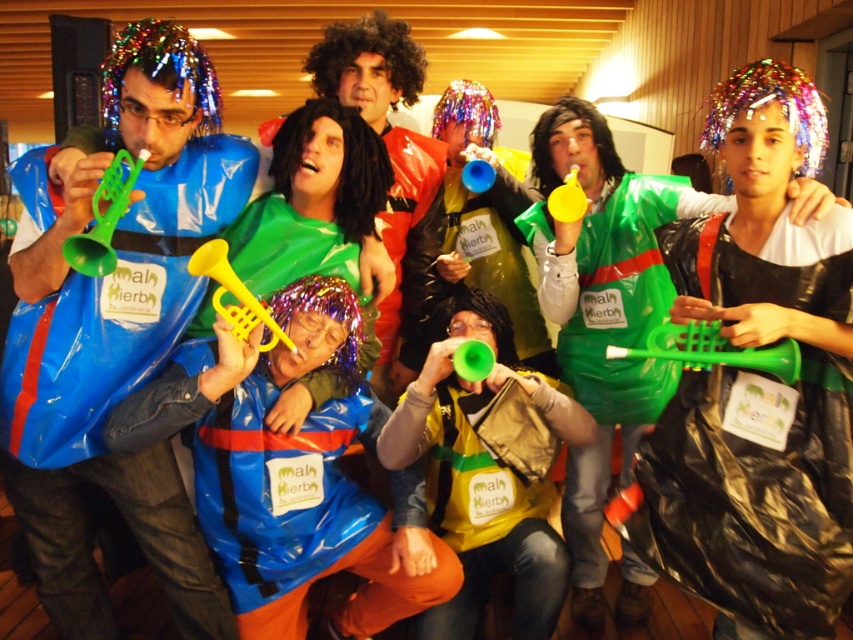
Is green plastic bag at center taller than green plastic trumpet at left?

Indeed, green plastic bag at center has a greater height compared to green plastic trumpet at left.

Can you confirm if green plastic bag at center is thinner than green plastic trumpet at left?

Incorrect, green plastic bag at center's width is not less than green plastic trumpet at left's.

This screenshot has width=853, height=640. What are the coordinates of `green plastic bag at center` in the screenshot? It's located at (608, 332).

Who is more distant from viewer, [508,291] or [450,104]?

Point [450,104]

Does green matte plastic bag at center have a lesser height compared to sparkly multicolored wig at center?

No.

Between point (515, 244) and point (477, 128), which one is positioned behind?

The point (477, 128) is more distant.

I want to click on green matte plastic bag at center, so click(471, 266).

Between green matte plastic bag at center and green plastic trumpet at lower right, which one appears on the left side from the viewer's perspective?

Positioned to the left is green matte plastic bag at center.

Who is more distant from viewer, (434,252) or (767,358)?

Point (434,252)

Describe the element at coordinates (471, 266) in the screenshot. I see `green matte plastic bag at center` at that location.

Locate an element on the screen. Image resolution: width=853 pixels, height=640 pixels. green matte plastic bag at center is located at coordinates (471, 266).